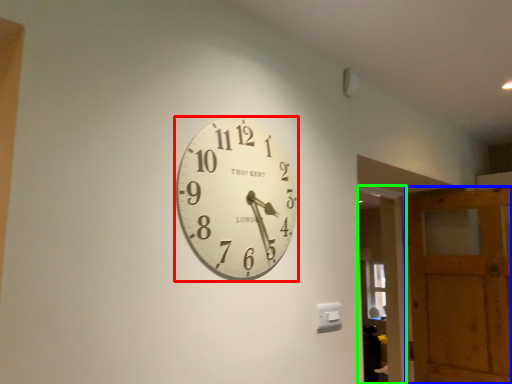
Question: Considering the real-world distances, which object is closest to wall clock (highlighted by a red box)? barn door (highlighted by a blue box) or glass door (highlighted by a green box).

Choices:
 (A) barn door
 (B) glass door

Answer: (B)